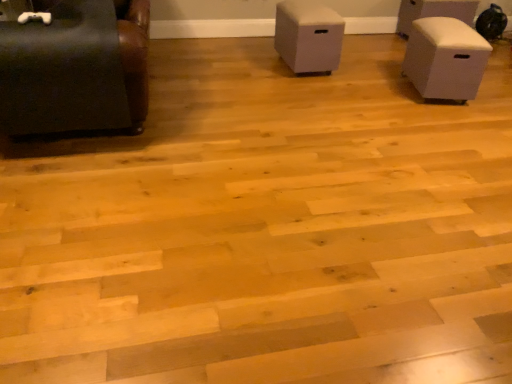
Question: Are beige matte storage box at right, which is counted as the second furniture, starting from the right, and white fabric ottoman at upper right, which is counted as the 4th furniture, starting from the left, making contact?

Choices:
 (A) yes
 (B) no

Answer: (B)

Question: Does beige matte storage box at right, which is counted as the third furniture, starting from the left, have a lesser height compared to white fabric ottoman at upper right, arranged as the first furniture when viewed from the back?

Choices:
 (A) no
 (B) yes

Answer: (A)

Question: Is the depth of beige matte storage box at right, the third furniture viewed from the back, greater than that of white fabric ottoman at upper right, arranged as the first furniture when viewed from the back?

Choices:
 (A) yes
 (B) no

Answer: (B)

Question: Is beige matte storage box at right, which is counted as the third furniture, starting from the left, at the left side of white fabric ottoman at upper right, arranged as the first furniture when viewed from the back?

Choices:
 (A) no
 (B) yes

Answer: (B)

Question: Does beige matte storage box at right, which is counted as the second furniture, starting from the right, have a lesser width compared to white fabric ottoman at upper right, marked as the 4th furniture in a front-to-back arrangement?

Choices:
 (A) yes
 (B) no

Answer: (A)

Question: Is white fabric ottoman at upper right, marked as the 4th furniture in a front-to-back arrangement, inside beige matte storage box at right, which is counted as the third furniture, starting from the left?

Choices:
 (A) no
 (B) yes

Answer: (A)

Question: Is white fabric ottoman at upper right, marked as the 4th furniture in a front-to-back arrangement, at the left side of matte black couch at left, the 1th furniture positioned from the front?

Choices:
 (A) yes
 (B) no

Answer: (B)

Question: Is white fabric ottoman at upper right, marked as the 4th furniture in a front-to-back arrangement, further to camera compared to matte black couch at left, marked as the first furniture in a left-to-right arrangement?

Choices:
 (A) no
 (B) yes

Answer: (B)

Question: Is white fabric ottoman at upper right, positioned as the 1th furniture in right-to-left order, wider than matte black couch at left, positioned as the 4th furniture in right-to-left order?

Choices:
 (A) no
 (B) yes

Answer: (A)

Question: Could you tell me if white fabric ottoman at upper right, marked as the 4th furniture in a front-to-back arrangement, is turned towards matte black couch at left, the fourth furniture positioned from the back?

Choices:
 (A) yes
 (B) no

Answer: (B)

Question: From a real-world perspective, is white fabric ottoman at upper right, which is counted as the 4th furniture, starting from the left, physically below matte black couch at left, positioned as the 4th furniture in right-to-left order?

Choices:
 (A) no
 (B) yes

Answer: (B)

Question: Is white fabric ottoman at upper right, which is counted as the 4th furniture, starting from the left, directly adjacent to matte black couch at left, the fourth furniture positioned from the back?

Choices:
 (A) no
 (B) yes

Answer: (A)

Question: Is beige matte storage box at right, which is counted as the second furniture, starting from the right, at the right side of white matte storage box at center, which is counted as the 2th furniture, starting from the left?

Choices:
 (A) yes
 (B) no

Answer: (A)